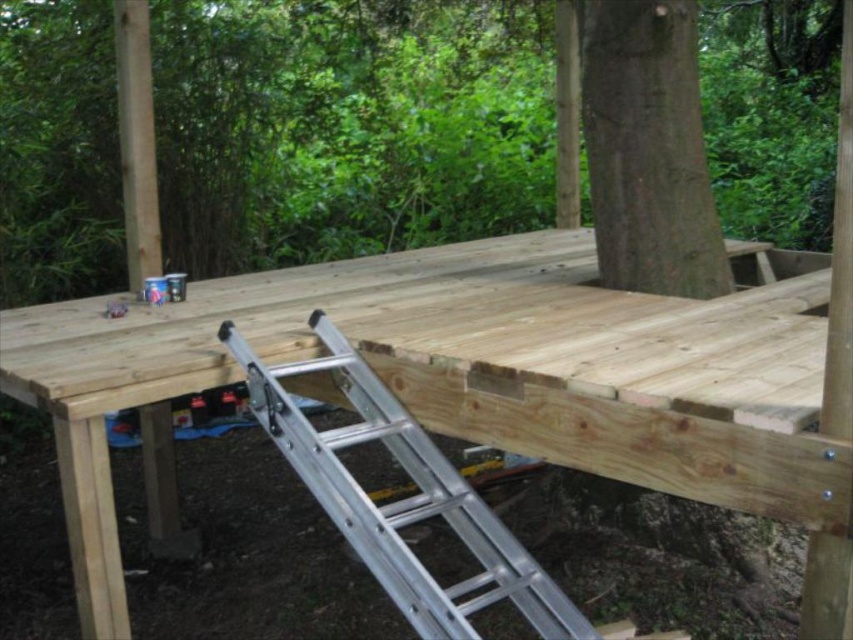
You are a construction worker standing at the camera position. You need to place a new wooden plank that is 10 meters long onto the deck. Can you safely place it without hitting the brown wood tree at center?

The brown wood tree at center is 10.62 meters from the camera. Since the plank is only 10 meters long, placing it would leave a gap of 0.62 meters between the end of the plank and the tree. Therefore, you can safely place the plank without hitting the tree.

You are standing at the edge of the deck and looking towards the center. Which tree is positioned to the right when you see the brown wood tree at center and the green rough bark tree at center?

The brown wood tree at center is positioned to the right of the green rough bark tree at center.